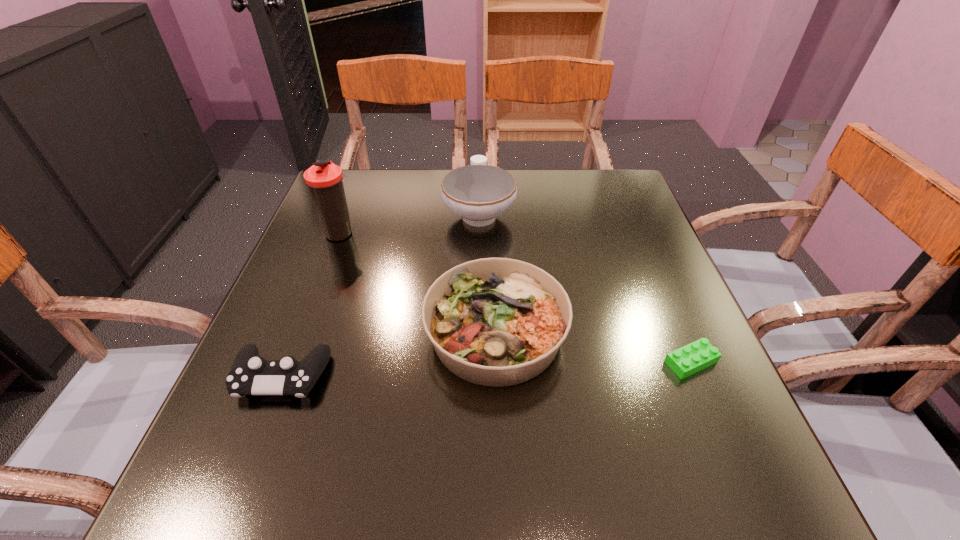
Identify the location of the tallest object. (325, 179).

Locate an element on the screen. the second tallest object is located at coordinates (478, 193).

Find the location of a particular element. salad plate is located at coordinates pos(497,322).

Identify the location of control. (251, 374).

What are the coordinates of `the rightmost object` in the screenshot? It's located at (696, 356).

Locate an element on the screen. This screenshot has height=540, width=960. the shortest object is located at coordinates (696, 356).

What are the coordinates of `vacant space located on the right of the thermos bottle` in the screenshot? It's located at tap(514, 233).

Identify the location of vacant space located 0.070m on the side with the handle of the fourth shortest object. Image resolution: width=960 pixels, height=540 pixels. (479, 174).

You are a GUI agent. You are given a task and a screenshot of the screen. Output one action in this format:
    pyautogui.click(x=<x>, y=<y>)
    Task: Click on the vacant area situated 0.390m on the back of the salad plate
    The image size is (960, 540).
    Given the screenshot: What is the action you would take?
    pyautogui.click(x=491, y=186)

You are a GUI agent. You are given a task and a screenshot of the screen. Output one action in this format:
    pyautogui.click(x=<x>, y=<y>)
    Task: Click on the vacant area situated 0.140m on the surface of the control
    The width and height of the screenshot is (960, 540).
    Given the screenshot: What is the action you would take?
    pyautogui.click(x=237, y=491)